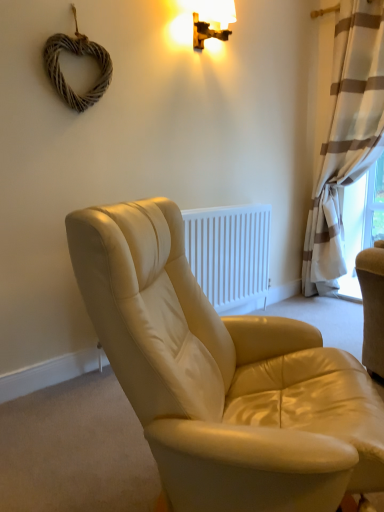
Question: From their relative heights in the image, would you say woven wood heart at upper left is taller or shorter than wooden wall sconce at upper center?

Choices:
 (A) tall
 (B) short

Answer: (A)

Question: Considering the positions of woven wood heart at upper left and wooden wall sconce at upper center in the image, is woven wood heart at upper left wider or thinner than wooden wall sconce at upper center?

Choices:
 (A) wide
 (B) thin

Answer: (B)

Question: Estimate the real-world distances between objects in this image. Which object is farther from the woven wood heart at upper left?

Choices:
 (A) wooden wall sconce at upper center
 (B) white striped curtain at right
 (C) leather chair at center

Answer: (B)

Question: Estimate the real-world distances between objects in this image. Which object is farther from the leather chair at center?

Choices:
 (A) woven wood heart at upper left
 (B) wooden wall sconce at upper center
 (C) white striped curtain at right

Answer: (C)